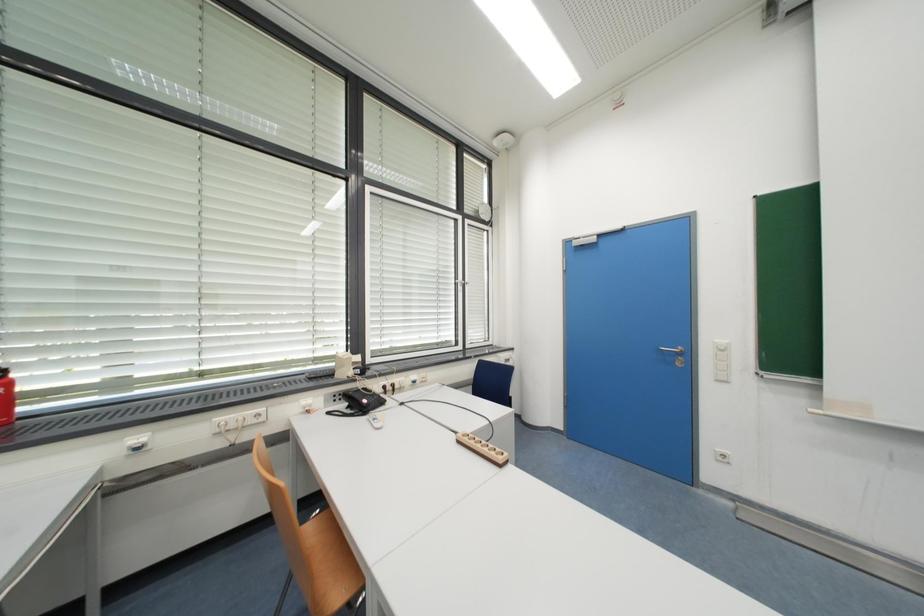
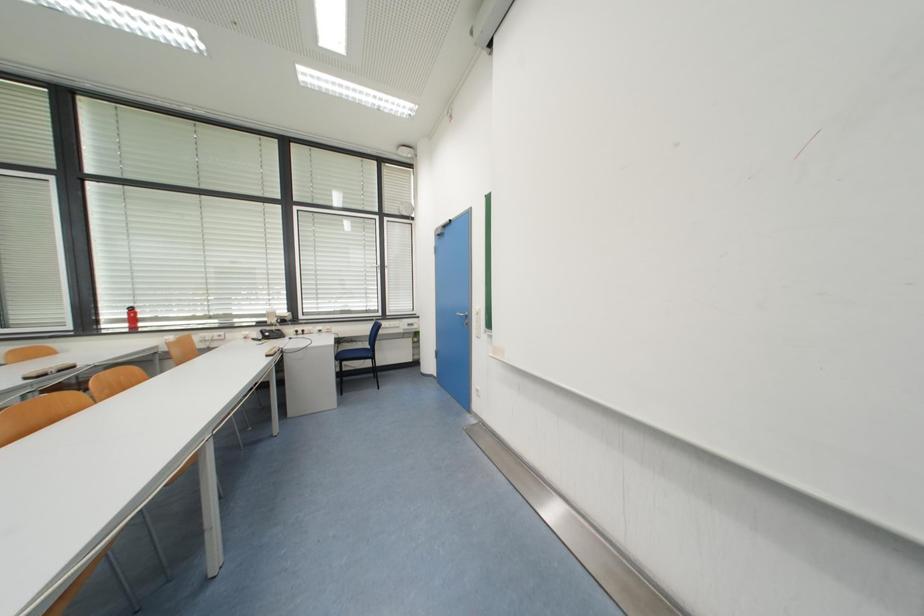
Question: In a continuous first-person perspective shot, in which direction is the camera moving?

Choices:
 (A) Left
 (B) Right
 (C) Forward
 (D) Backward

Answer: (B)